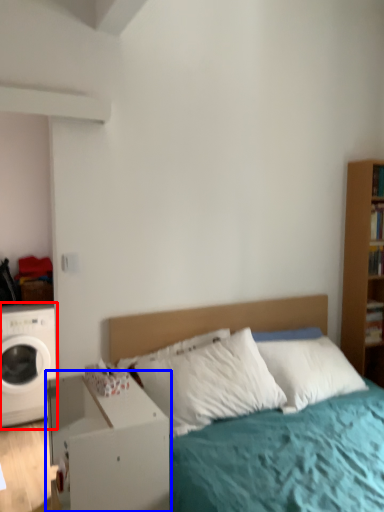
Question: Which point is further to the camera, washing machine (highlighted by a red box) or nightstand (highlighted by a blue box)?

Choices:
 (A) washing machine
 (B) nightstand

Answer: (A)